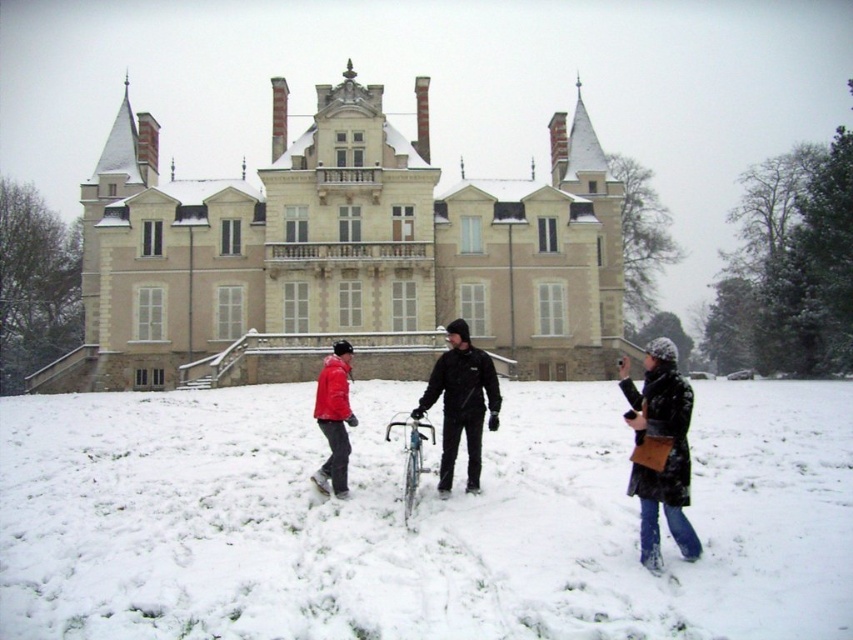
What do you see at coordinates (416, 518) in the screenshot? This screenshot has height=640, width=853. I see `white fluffy snow at center` at bounding box center [416, 518].

Based on the photo, measure the distance from white fluffy snow at center to black textured coat at lower right.

17.98 meters

Locate an element on the screen. The image size is (853, 640). white fluffy snow at center is located at coordinates (416, 518).

Between point (151, 529) and point (97, 225), which one is positioned behind?

Positioned behind is point (97, 225).

Looking at this image, is white fluffy snow at center wider than beige stone palace at center?

No.

Measure the distance between white fluffy snow at center and camera.

white fluffy snow at center is 36.51 meters away from camera.

At what (x,y) coordinates should I click in order to perform the action: click on white fluffy snow at center. Please return your answer as a coordinate pair (x, y). The width and height of the screenshot is (853, 640). Looking at the image, I should click on (416, 518).

Who is more forward, (x=651, y=470) or (x=456, y=364)?

Point (x=651, y=470)

Is point (650, 465) closer to camera compared to point (488, 385)?

Yes, point (650, 465) is closer to viewer.

Locate an element on the screen. The height and width of the screenshot is (640, 853). black textured coat at lower right is located at coordinates (660, 451).